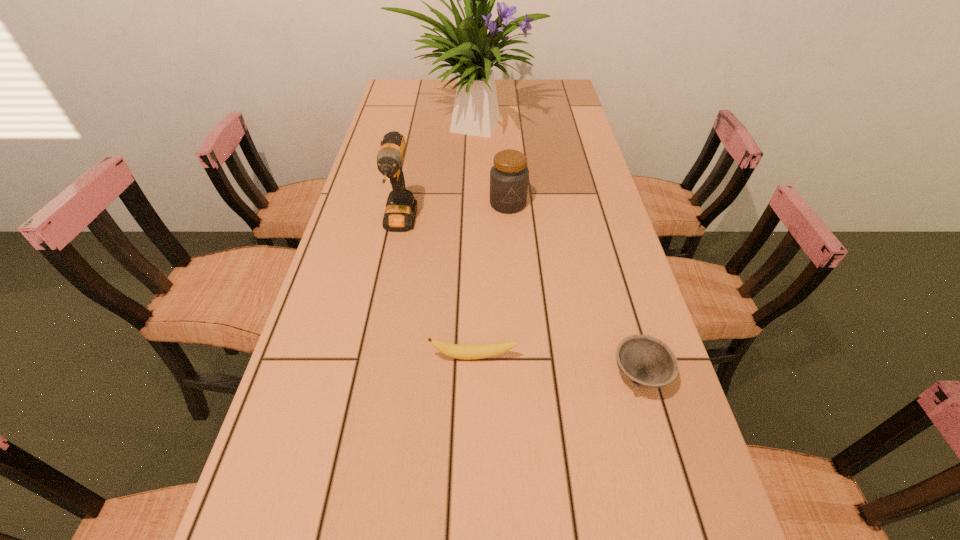
What are the coordinates of `vacant space located on the front of the rightmost object` in the screenshot? It's located at click(662, 454).

The width and height of the screenshot is (960, 540). Identify the location of object located at the far edge. (471, 52).

Identify the location of flower arrangement that is positioned at the left edge. (471, 52).

I want to click on drill located in the left edge section of the desktop, so click(401, 207).

Identify the location of flower arrangement positioned at the right edge. The width and height of the screenshot is (960, 540). (471, 52).

This screenshot has height=540, width=960. I want to click on bowl present at the right edge, so click(647, 362).

Locate an element on the screen. Image resolution: width=960 pixels, height=540 pixels. object that is at the far left corner is located at coordinates (471, 52).

You are a GUI agent. You are given a task and a screenshot of the screen. Output one action in this format:
    pyautogui.click(x=<x>, y=<y>)
    Task: Click on the object that is at the far right corner
    This screenshot has width=960, height=540.
    Given the screenshot: What is the action you would take?
    pyautogui.click(x=471, y=52)

Identify the location of free space at the far edge of the desktop. The height and width of the screenshot is (540, 960). (516, 103).

Locate an element on the screen. free region at the left edge of the desktop is located at coordinates (412, 114).